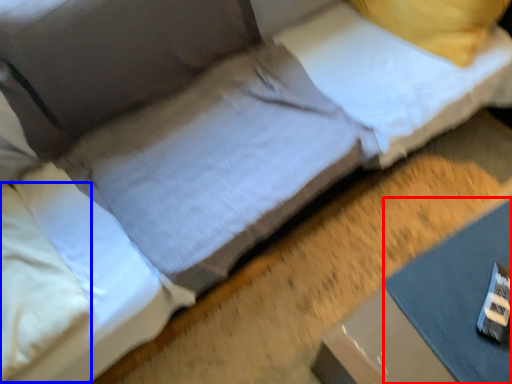
Question: Which object appears farthest to the camera in this image, sheet (highlighted by a red box) or pillow (highlighted by a blue box)?

Choices:
 (A) sheet
 (B) pillow

Answer: (A)